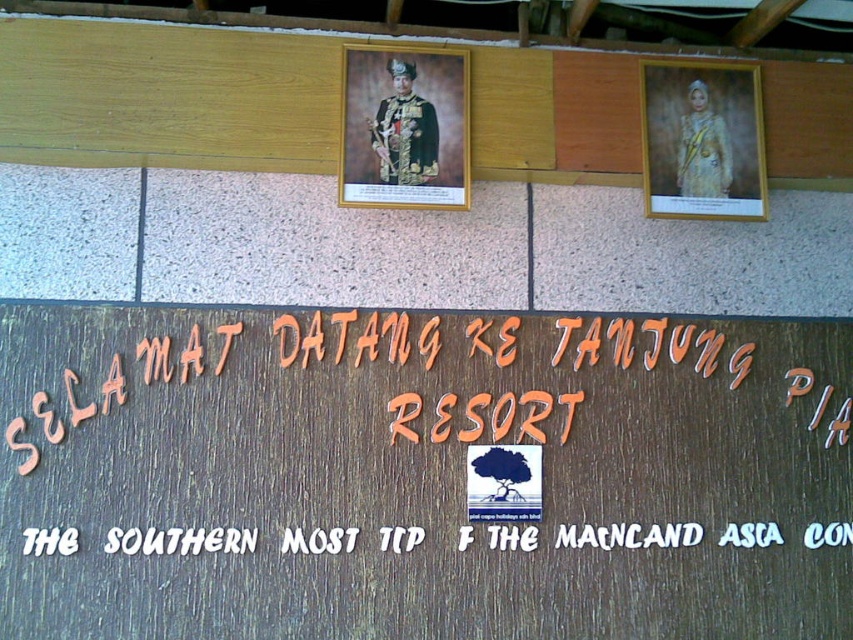
Question: Is wooden frame at upper center below white wood sign at lower center?

Choices:
 (A) no
 (B) yes

Answer: (A)

Question: Does gold textured fabric at upper right appear on the right side of white wood sign at lower center?

Choices:
 (A) no
 (B) yes

Answer: (B)

Question: Which point is farther to the camera?

Choices:
 (A) (709, 321)
 (B) (341, 531)
 (C) (654, 134)

Answer: (A)

Question: Which point is farther from the camera taking this photo?

Choices:
 (A) (850, 339)
 (B) (735, 531)
 (C) (82, 65)
 (D) (444, 118)

Answer: (A)

Question: Observing the image, what is the correct spatial positioning of wooden signboard at center in reference to gold textured fabric at upper right?

Choices:
 (A) left
 (B) right

Answer: (A)

Question: Considering the real-world distances, which object is closest to the gold textured fabric at upper right?

Choices:
 (A) white wood sign at lower center
 (B) wooden signboard at center

Answer: (B)